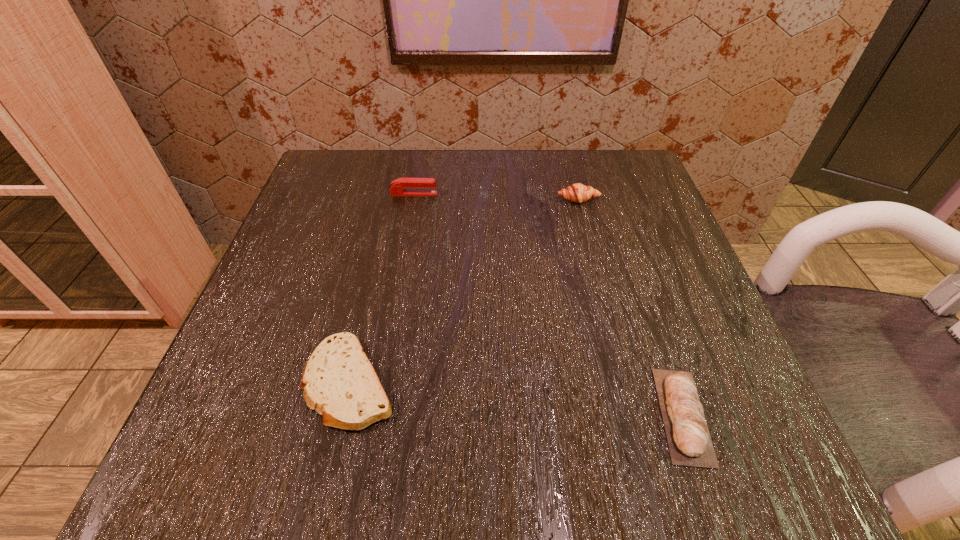
At what (x,y) coordinates should I click in order to perform the action: click on vacant region at the right edge of the desktop. Please return your answer as a coordinate pair (x, y). The width and height of the screenshot is (960, 540). Looking at the image, I should click on (678, 336).

Where is `free region at the far left corner of the desktop`? Image resolution: width=960 pixels, height=540 pixels. free region at the far left corner of the desktop is located at coordinates (297, 208).

Locate an element on the screen. Image resolution: width=960 pixels, height=540 pixels. free space at the near left corner of the desktop is located at coordinates (273, 443).

This screenshot has height=540, width=960. What are the coordinates of `vacant space at the far right corner of the desktop` in the screenshot? It's located at (612, 158).

This screenshot has width=960, height=540. In the image, there is a desktop. What are the coordinates of `vacant space at the near right corner` in the screenshot? It's located at (643, 422).

The height and width of the screenshot is (540, 960). I want to click on free space between the left pita bread and the taller pita bread, so click(x=516, y=399).

Identify the location of free point between the right pita bread and the pastry. (631, 307).

Image resolution: width=960 pixels, height=540 pixels. I want to click on free point between the pastry and the stapler, so click(496, 197).

Identify the location of free spot between the shortest object and the pastry. The image size is (960, 540). (465, 291).

In order to click on empty space that is in between the stapler and the right pita bread in this screenshot , I will do `click(548, 305)`.